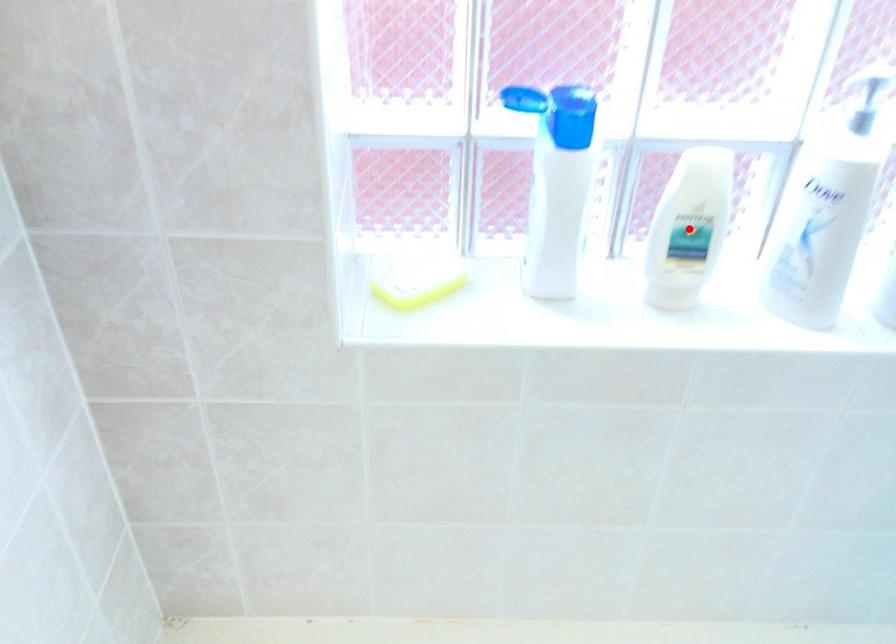
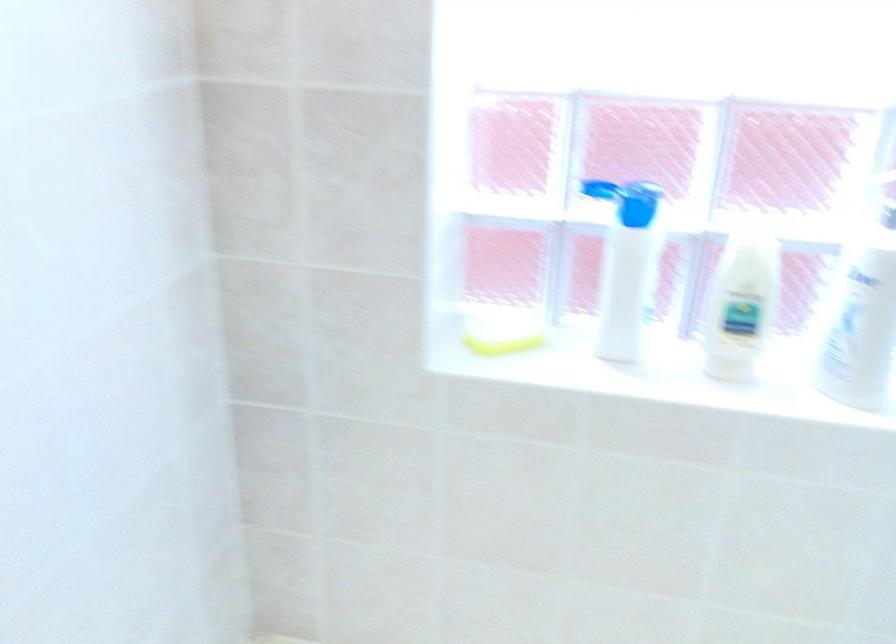
Question: I am providing you with two images of the same scene from different viewpoints. A red point is shown in image1. For the corresponding object point in image2, is it positioned nearer or farther from the camera?

Choices:
 (A) Nearer
 (B) Farther

Answer: (B)